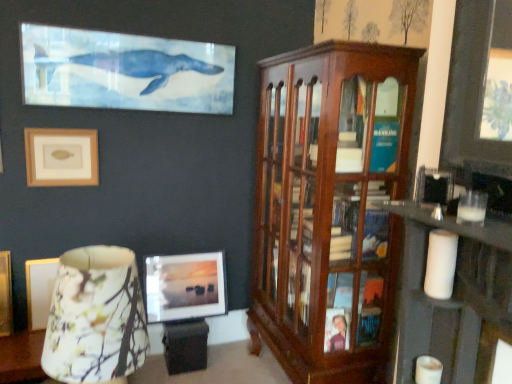
What is the approximate width of white matte candle at lower right, arranged as the second candle when viewed from the top?

Answer: 3.26 inches.

Image resolution: width=512 pixels, height=384 pixels. What do you see at coordinates (440, 264) in the screenshot? I see `white matte candle at right, which is the first candle in top-to-bottom order` at bounding box center [440, 264].

Identify the location of mahogany wood cabinet at right. This screenshot has height=384, width=512. (330, 207).

What is the approximate width of beige matte picture frame at upper left, the first picture frame when ordered from front to back?

beige matte picture frame at upper left, the first picture frame when ordered from front to back, is 2.18 inches wide.

Identify the location of white matte candle at lower right, arranged as the second candle when viewed from the top. The width and height of the screenshot is (512, 384). (428, 370).

From the image's perspective, is matte glass picture frame at center, marked as the 1th picture frame in a right-to-left arrangement, beneath floral fabric lampshade at lower left?

Correct, matte glass picture frame at center, marked as the 1th picture frame in a right-to-left arrangement, appears lower than floral fabric lampshade at lower left in the image.

Are matte glass picture frame at center, which ranks as the second picture frame in top-to-bottom order, and floral fabric lampshade at lower left beside each other?

No, matte glass picture frame at center, which ranks as the second picture frame in top-to-bottom order, is not touching floral fabric lampshade at lower left.

Does matte glass picture frame at center, arranged as the first picture frame when ordered from the bottom, have a smaller size compared to floral fabric lampshade at lower left?

Correct, matte glass picture frame at center, arranged as the first picture frame when ordered from the bottom, occupies less space than floral fabric lampshade at lower left.

The height and width of the screenshot is (384, 512). Identify the location of picture frame below the floral fabric lampshade at lower left (from the image's perspective). (185, 286).

Considering the sizes of objects matte glass picture frame at center, the 1th picture frame when ordered from back to front, and beige matte picture frame at upper left, acting as the second picture frame starting from the right, in the image provided, who is taller, matte glass picture frame at center, the 1th picture frame when ordered from back to front, or beige matte picture frame at upper left, acting as the second picture frame starting from the right,?

matte glass picture frame at center, the 1th picture frame when ordered from back to front.

Does point (217, 305) come closer to viewer compared to point (37, 152)?

No, (217, 305) is behind (37, 152).

Is matte glass picture frame at center, arranged as the first picture frame when ordered from the bottom, far away from beige matte picture frame at upper left, acting as the second picture frame starting from the right?

No, matte glass picture frame at center, arranged as the first picture frame when ordered from the bottom, is not far from beige matte picture frame at upper left, acting as the second picture frame starting from the right.

From the picture: Which point is more forward, [353,199] or [56,182]?

The point [353,199] is in front.

Is mahogany wood cabinet at right in front of beige matte picture frame at upper left, the first picture frame when ordered from front to back?

Yes, the depth of mahogany wood cabinet at right is less than that of beige matte picture frame at upper left, the first picture frame when ordered from front to back.

Where is `picture frame above the mahogany wood cabinet at right (from a real-world perspective)`? This screenshot has height=384, width=512. picture frame above the mahogany wood cabinet at right (from a real-world perspective) is located at coordinates (61, 157).

From the image's perspective, relative to beige matte picture frame at upper left, acting as the second picture frame starting from the right, is mahogany wood cabinet at right above or below?

From the image's perspective, mahogany wood cabinet at right appears below beige matte picture frame at upper left, acting as the second picture frame starting from the right.

Which is more to the left, floral fabric lampshade at lower left or white matte candle at right, the second candle from the bottom?

From the viewer's perspective, floral fabric lampshade at lower left appears more on the left side.

Considering the relative sizes of floral fabric lampshade at lower left and white matte candle at right, the second candle from the bottom, in the image provided, is floral fabric lampshade at lower left smaller than white matte candle at right, the second candle from the bottom,?

No, floral fabric lampshade at lower left is not smaller than white matte candle at right, the second candle from the bottom.

Does floral fabric lampshade at lower left have a lesser height compared to white matte candle at right, the second candle from the bottom?

No, floral fabric lampshade at lower left is not shorter than white matte candle at right, the second candle from the bottom.

From a real-world perspective, relative to white matte candle at right, the second candle from the bottom, is floral fabric lampshade at lower left vertically above or below?

In terms of real-world spatial position, floral fabric lampshade at lower left is below white matte candle at right, the second candle from the bottom.

Is beige matte picture frame at upper left, placed as the 2th picture frame when sorted from back to front, at the left side of matte glass picture frame at center, which ranks as the second picture frame in top-to-bottom order?

Yes.

Is matte glass picture frame at center, the 2th picture frame viewed from the left, located within beige matte picture frame at upper left, placed as the first picture frame when sorted from top to bottom?

That's incorrect, matte glass picture frame at center, the 2th picture frame viewed from the left, is not inside beige matte picture frame at upper left, placed as the first picture frame when sorted from top to bottom.

Which of these two, beige matte picture frame at upper left, placed as the 2th picture frame when sorted from back to front, or matte glass picture frame at center, the 2th picture frame viewed from the left, is smaller?

Smaller between the two is beige matte picture frame at upper left, placed as the 2th picture frame when sorted from back to front.

How different are the orientations of white matte candle at right, the second candle from the bottom, and beige matte picture frame at upper left, placed as the 2th picture frame when sorted from back to front, in degrees?

The facing directions of white matte candle at right, the second candle from the bottom, and beige matte picture frame at upper left, placed as the 2th picture frame when sorted from back to front, are 83.8 degrees apart.

Considering the relative sizes of white matte candle at right, which is the first candle in top-to-bottom order, and beige matte picture frame at upper left, the first picture frame when ordered from front to back, in the image provided, is white matte candle at right, which is the first candle in top-to-bottom order, smaller than beige matte picture frame at upper left, the first picture frame when ordered from front to back,?

Indeed, white matte candle at right, which is the first candle in top-to-bottom order, has a smaller size compared to beige matte picture frame at upper left, the first picture frame when ordered from front to back.

Where is `the 2nd candle to the right when counting from the beige matte picture frame at upper left, which is the second picture frame from bottom to top`? This screenshot has height=384, width=512. the 2nd candle to the right when counting from the beige matte picture frame at upper left, which is the second picture frame from bottom to top is located at coordinates (440, 264).

From a real-world perspective, is white matte candle at right, the second candle from the bottom, physically located above or below beige matte picture frame at upper left, the first picture frame when ordered from front to back?

white matte candle at right, the second candle from the bottom, is below beige matte picture frame at upper left, the first picture frame when ordered from front to back.

Looking at this image, from a real-world perspective, is beige matte picture frame at upper left, the 1th picture frame when ordered from left to right, positioned above or below white matte candle at right, which is the first candle in top-to-bottom order?

Clearly, from a real-world perspective, beige matte picture frame at upper left, the 1th picture frame when ordered from left to right, is above white matte candle at right, which is the first candle in top-to-bottom order.

Is beige matte picture frame at upper left, placed as the 2th picture frame when sorted from back to front, positioned beyond the bounds of white matte candle at right, which is the first candle in top-to-bottom order?

Yes, beige matte picture frame at upper left, placed as the 2th picture frame when sorted from back to front, is not within white matte candle at right, which is the first candle in top-to-bottom order.

Does beige matte picture frame at upper left, placed as the 2th picture frame when sorted from back to front, have a greater height compared to white matte candle at right, which is the first candle in top-to-bottom order?

Yes.

What's the angular difference between beige matte picture frame at upper left, placed as the first picture frame when sorted from top to bottom, and white matte candle at right, which is the first candle in top-to-bottom order,'s facing directions?

The angular difference between beige matte picture frame at upper left, placed as the first picture frame when sorted from top to bottom, and white matte candle at right, which is the first candle in top-to-bottom order, is 83.8 degrees.

Locate an element on the screen. This screenshot has width=512, height=384. table lamp above the matte glass picture frame at center, the 2th picture frame viewed from the left (from a real-world perspective) is located at coordinates (96, 317).

Where is `picture frame that appears behind the beige matte picture frame at upper left, placed as the 2th picture frame when sorted from back to front`? Image resolution: width=512 pixels, height=384 pixels. picture frame that appears behind the beige matte picture frame at upper left, placed as the 2th picture frame when sorted from back to front is located at coordinates click(185, 286).

When comparing their distances from white matte candle at lower right, which is the first candle from bottom to top, does white matte candle at right, the second candle from the bottom, or beige matte picture frame at upper left, the first picture frame when ordered from front to back, seem further?

beige matte picture frame at upper left, the first picture frame when ordered from front to back, lies further to white matte candle at lower right, which is the first candle from bottom to top, than the other object.

Considering their positions, is beige matte picture frame at upper left, which is the second picture frame from bottom to top, positioned closer to matte glass picture frame at center, which ranks as the second picture frame in top-to-bottom order, than white matte candle at right, which is the first candle in top-to-bottom order?

beige matte picture frame at upper left, which is the second picture frame from bottom to top, is positioned closer to the anchor matte glass picture frame at center, which ranks as the second picture frame in top-to-bottom order.

When comparing their distances from white matte candle at lower right, arranged as the second candle when viewed from the top, does matte glass picture frame at center, arranged as the 2th picture frame when viewed from the front, or white matte candle at right, which is the first candle in top-to-bottom order, seem closer?

Among the two, white matte candle at right, which is the first candle in top-to-bottom order, is located nearer to white matte candle at lower right, arranged as the second candle when viewed from the top.

Which object lies nearer to the anchor point floral fabric lampshade at lower left, matte glass picture frame at center, which ranks as the second picture frame in top-to-bottom order, or white matte candle at right, the second candle from the bottom?

Among the two, white matte candle at right, the second candle from the bottom, is located nearer to floral fabric lampshade at lower left.

When comparing their distances from matte glass picture frame at center, the 2th picture frame viewed from the left, does mahogany wood cabinet at right or floral fabric lampshade at lower left seem further?

floral fabric lampshade at lower left.

Looking at the image, which one is located further to floral fabric lampshade at lower left, white matte candle at lower right, arranged as the second candle when viewed from the top, or matte glass picture frame at center, arranged as the first picture frame when ordered from the bottom?

Based on the image, matte glass picture frame at center, arranged as the first picture frame when ordered from the bottom, appears to be further to floral fabric lampshade at lower left.

Which object lies nearer to the anchor point mahogany wood cabinet at right, white matte candle at right, the second candle from the bottom, or beige matte picture frame at upper left, placed as the 2th picture frame when sorted from back to front?

white matte candle at right, the second candle from the bottom, is positioned closer to the anchor mahogany wood cabinet at right.

Based on their spatial positions, is mahogany wood cabinet at right or matte glass picture frame at center, which ranks as the second picture frame in top-to-bottom order, closer to floral fabric lampshade at lower left?

The object closer to floral fabric lampshade at lower left is mahogany wood cabinet at right.

At what (x,y) coordinates should I click in order to perform the action: click on candle between mahogany wood cabinet at right and white matte candle at lower right, which is the first candle from bottom to top, vertically. Please return your answer as a coordinate pair (x, y). Looking at the image, I should click on (440, 264).

Find the location of a particular element. This screenshot has width=512, height=384. cabinetry between floral fabric lampshade at lower left and white matte candle at right, the second candle from the bottom, from left to right is located at coordinates (330, 207).

Where is `picture frame between beige matte picture frame at upper left, acting as the second picture frame starting from the right, and mahogany wood cabinet at right from left to right`? picture frame between beige matte picture frame at upper left, acting as the second picture frame starting from the right, and mahogany wood cabinet at right from left to right is located at coordinates (185, 286).

What are the coordinates of `candle between white matte candle at right, the second candle from the bottom, and matte glass picture frame at center, arranged as the first picture frame when ordered from the bottom, from front to back` in the screenshot? It's located at (428, 370).